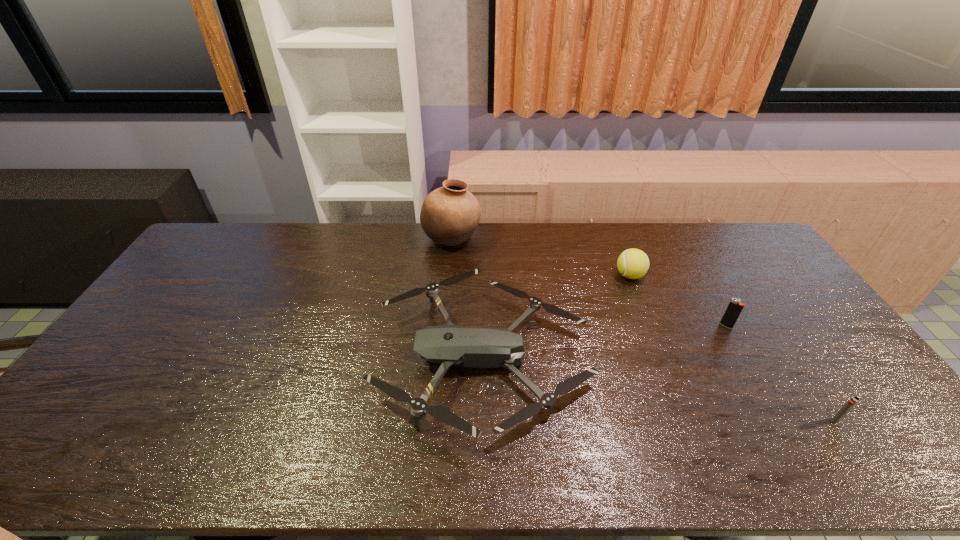
Find the location of a particular element. Image resolution: width=960 pixels, height=540 pixels. pottery is located at coordinates (449, 215).

The image size is (960, 540). What are the coordinates of `the tallest object` in the screenshot? It's located at (449, 215).

This screenshot has height=540, width=960. Identify the location of the left igniter. [x=735, y=307].

The image size is (960, 540). I want to click on the fourth object from left to right, so click(x=735, y=307).

I want to click on the fourth nearest object, so click(632, 263).

Image resolution: width=960 pixels, height=540 pixels. In order to click on the third object from right to left in this screenshot , I will do `click(632, 263)`.

Locate an element on the screen. the rightmost object is located at coordinates (850, 403).

Locate an element on the screen. This screenshot has width=960, height=540. the shorter igniter is located at coordinates (850, 403).

Identify the location of drone. The image size is (960, 540). (471, 347).

Find the location of a particular element. The width and height of the screenshot is (960, 540). blank space located on the left of the tallest object is located at coordinates (346, 239).